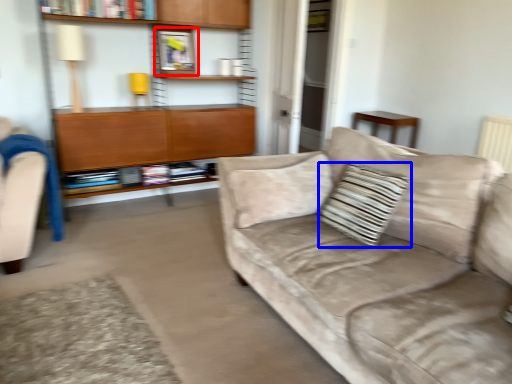
Question: Which object appears farthest to the camera in this image, picture frame (highlighted by a red box) or throw pillow (highlighted by a blue box)?

Choices:
 (A) picture frame
 (B) throw pillow

Answer: (A)